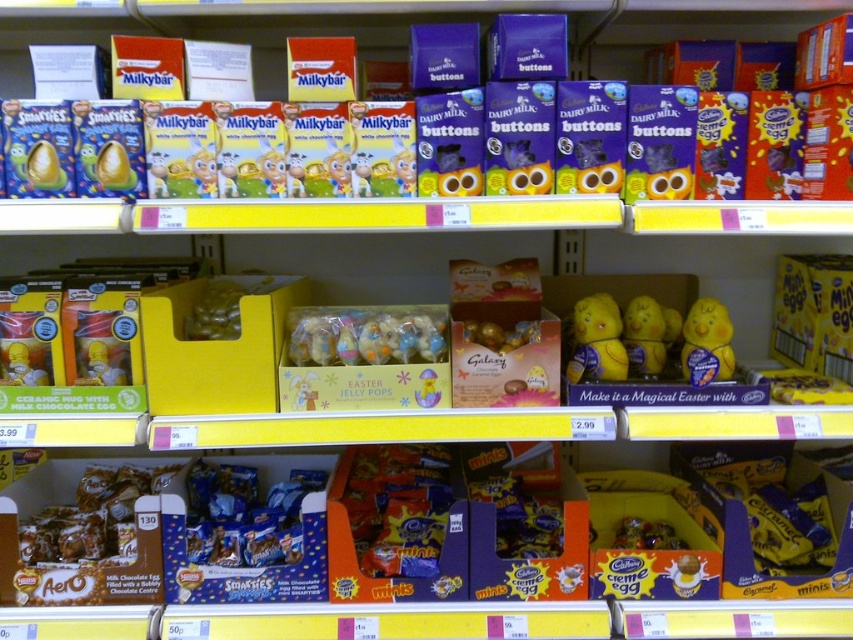
Question: Which of the following is the closest to the observer?

Choices:
 (A) (532, 339)
 (B) (416, 316)
 (C) (202, 298)

Answer: (A)

Question: Is translucent yellow jelly beans at center to the left of shiny gold foil wrapped chocolate at center from the viewer's perspective?

Choices:
 (A) no
 (B) yes

Answer: (B)

Question: Is pastel candy at center to the right of shiny gold foil wrapped chocolate at center from the viewer's perspective?

Choices:
 (A) yes
 (B) no

Answer: (B)

Question: Is pastel candy at center positioned behind shiny gold foil wrapped chocolate at center?

Choices:
 (A) no
 (B) yes

Answer: (A)

Question: Which object appears farthest from the camera in this image?

Choices:
 (A) pastel candy at center
 (B) shiny gold foil wrapped chocolate at center

Answer: (B)

Question: Considering the real-world distances, which object is closest to the pastel candy at center?

Choices:
 (A) shiny gold foil wrapped chocolate at center
 (B) translucent yellow jelly beans at center

Answer: (A)